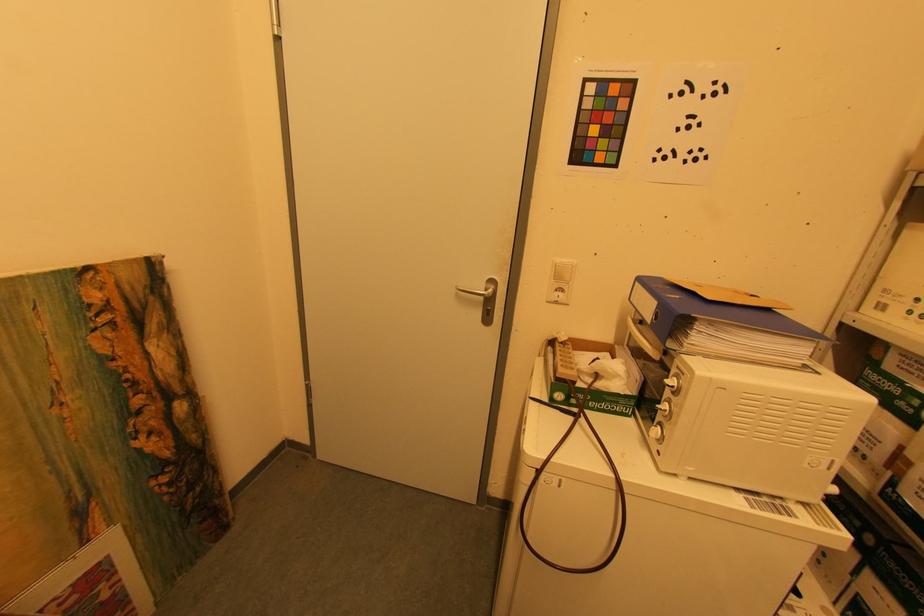
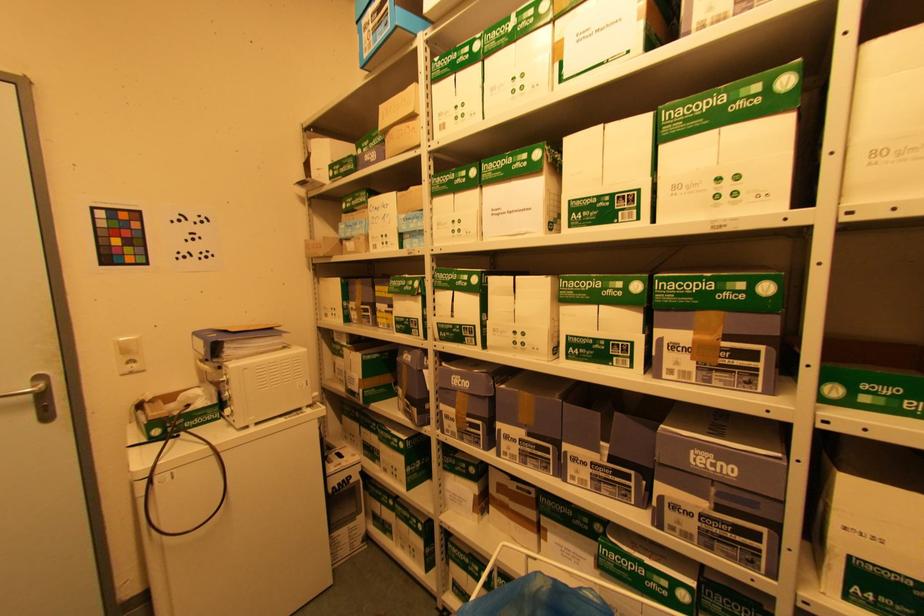
Question: How did the camera likely rotate?

Choices:
 (A) Left
 (B) Right
 (C) Up
 (D) Down

Answer: (B)